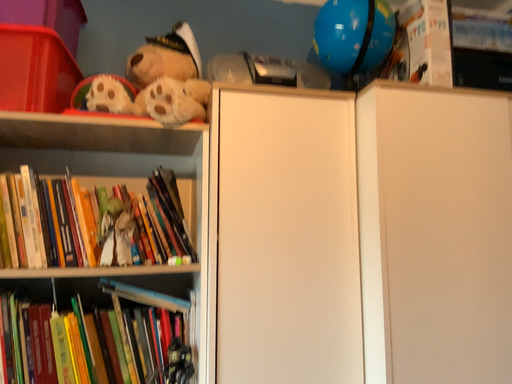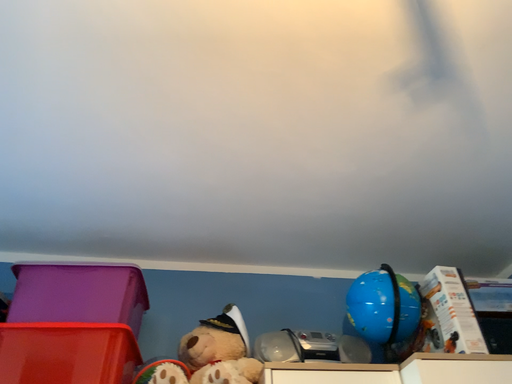
Question: Which way did the camera rotate in the video?

Choices:
 (A) rotated downward
 (B) rotated upward

Answer: (B)